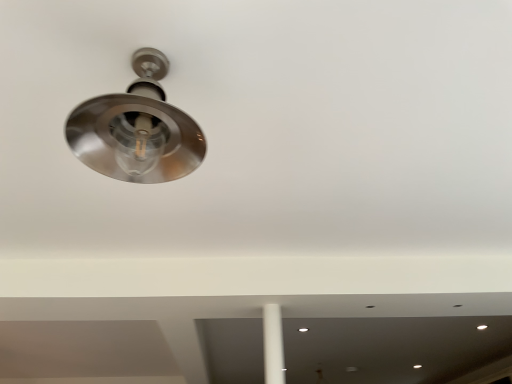
Describe the element at coordinates (137, 129) in the screenshot. I see `satin nickel light fixture at upper left` at that location.

The image size is (512, 384). I want to click on satin nickel light fixture at upper left, so click(x=137, y=129).

I want to click on satin nickel light fixture at upper left, so click(137, 129).